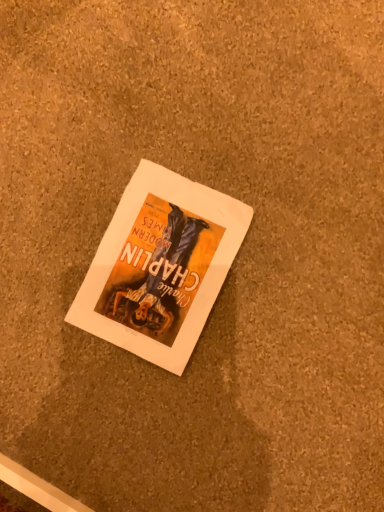
This screenshot has height=512, width=384. I want to click on free point behind matte paper book at center, so click(126, 125).